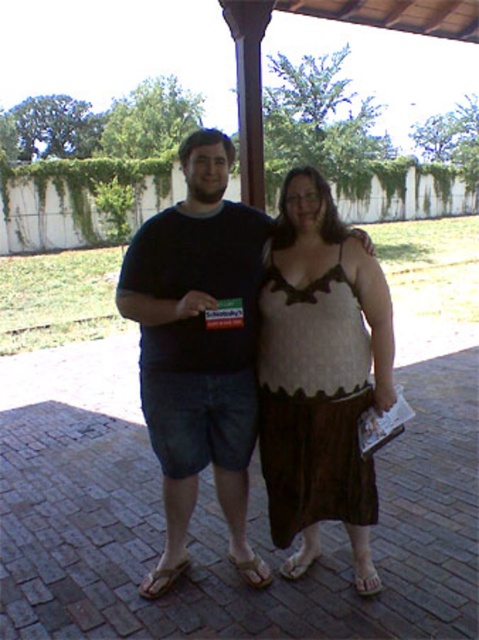
Is brown textured skirt at center to the left of knitted brown dress at center from the viewer's perspective?

Correct, you'll find brown textured skirt at center to the left of knitted brown dress at center.

Does point (171, 268) lie behind point (272, 435)?

No, it is in front of (272, 435).

Who is more distant from viewer, (x=193, y=419) or (x=289, y=449)?

Point (x=289, y=449)

In order to click on brown textured skirt at center in this screenshot , I will do `click(198, 348)`.